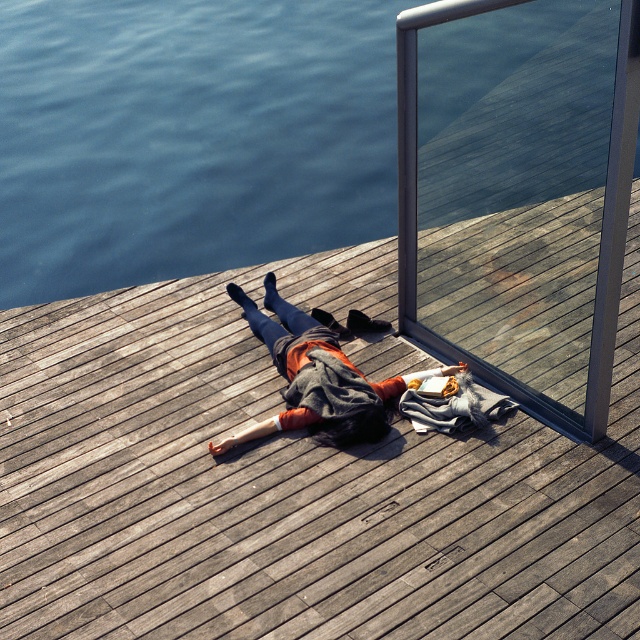
Can you confirm if brushed metal rail at upper right is smaller than orange sweater at center?

Incorrect, brushed metal rail at upper right is not smaller in size than orange sweater at center.

Does point (570, 141) lie in front of point (268, 342)?

That is True.

The image size is (640, 640). What do you see at coordinates (518, 192) in the screenshot? I see `brushed metal rail at upper right` at bounding box center [518, 192].

Where is `brushed metal rail at upper right`? The image size is (640, 640). brushed metal rail at upper right is located at coordinates (518, 192).

Which of these two, wooden dock at center or brushed metal rail at upper right, stands shorter?

wooden dock at center is shorter.

Is wooden dock at center bigger than brushed metal rail at upper right?

Correct, wooden dock at center is larger in size than brushed metal rail at upper right.

Is point (632, 220) positioned before point (595, 99)?

No.

Where is `wooden dock at center`? wooden dock at center is located at coordinates (291, 483).

Looking at this image, is wooden dock at center taller than blue water at upper left?

No.

Between wooden dock at center and blue water at upper left, which one is positioned lower?

wooden dock at center is lower down.

Find the location of a particular element. wooden dock at center is located at coordinates (291, 483).